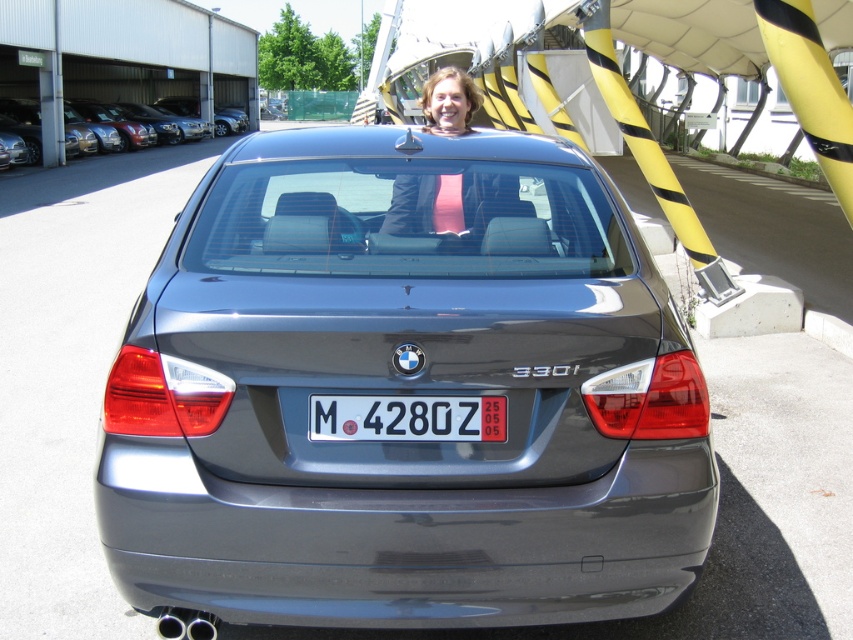
Is satin metallic car at center to the right of satin metallic sedan at upper left from the viewer's perspective?

Indeed, satin metallic car at center is positioned on the right side of satin metallic sedan at upper left.

Who is positioned more to the left, satin metallic car at center or satin metallic sedan at upper left?

satin metallic sedan at upper left is more to the left.

Who is more forward, (467, 356) or (86, 136)?

Positioned in front is point (467, 356).

The height and width of the screenshot is (640, 853). Find the location of `satin metallic car at center`. satin metallic car at center is located at coordinates (405, 392).

How much distance is there between satin metallic car at center and white plastic license plate at center?

46.98 centimeters

Which is above, satin metallic car at center or white plastic license plate at center?

satin metallic car at center is above.

Between point (291, 163) and point (415, 426), which one is positioned in front?

Point (415, 426)

Identify the location of satin metallic car at center. (405, 392).

Who is higher up, pink fabric at center or satin metallic sedan at upper left?

satin metallic sedan at upper left is above.

Which is more to the right, pink fabric at center or satin metallic sedan at upper left?

pink fabric at center is more to the right.

Which is in front, point (421, 208) or point (32, 161)?

Point (421, 208) is in front.

Locate an element on the screen. Image resolution: width=853 pixels, height=640 pixels. pink fabric at center is located at coordinates (427, 205).